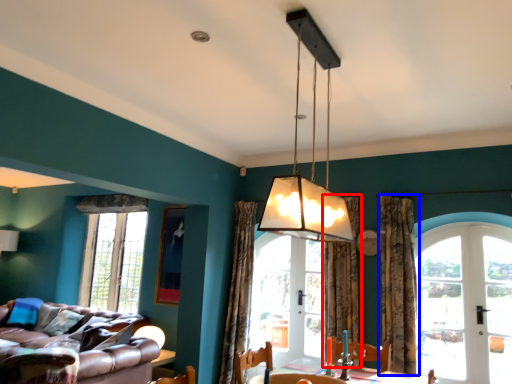
Question: Which of the following is the closest to the observer, curtain (highlighted by a red box) or curtain (highlighted by a blue box)?

Choices:
 (A) curtain
 (B) curtain

Answer: (B)